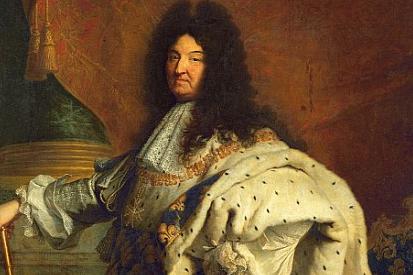
Image resolution: width=413 pixels, height=275 pixels. In order to click on tapestry in this screenshot , I will do `click(88, 23)`.